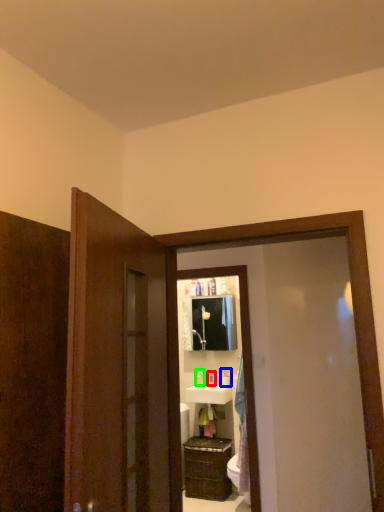
Question: Which object is the farthest from toiletry (highlighted by a red box)? Choose among these: toiletry (highlighted by a blue box) or toiletry (highlighted by a green box).

Choices:
 (A) toiletry
 (B) toiletry

Answer: (A)